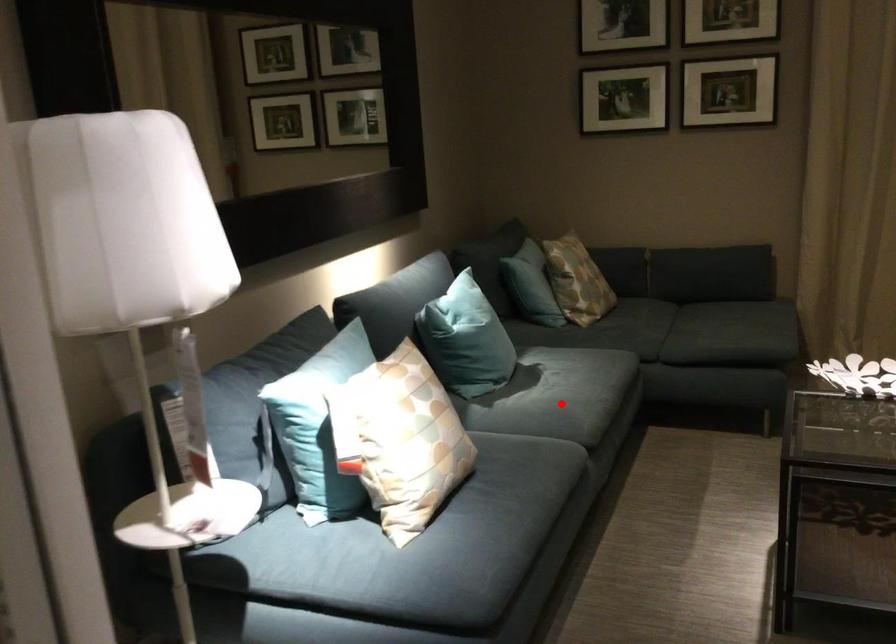
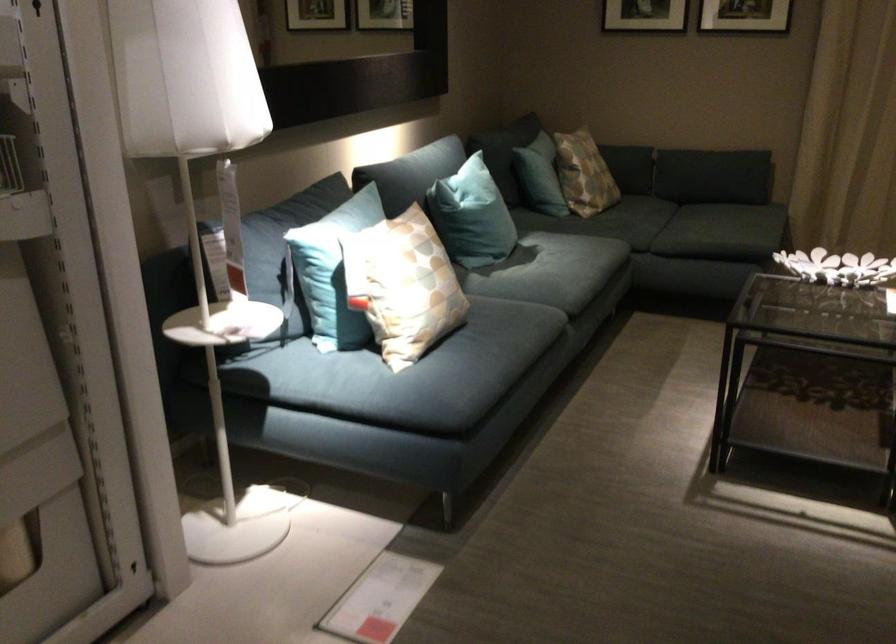
Question: I am providing you with two images of the same scene from different viewpoints. A red point is shown in image1. For the corresponding object point in image2, is it positioned nearer or farther from the camera?

Choices:
 (A) Nearer
 (B) Farther

Answer: (B)